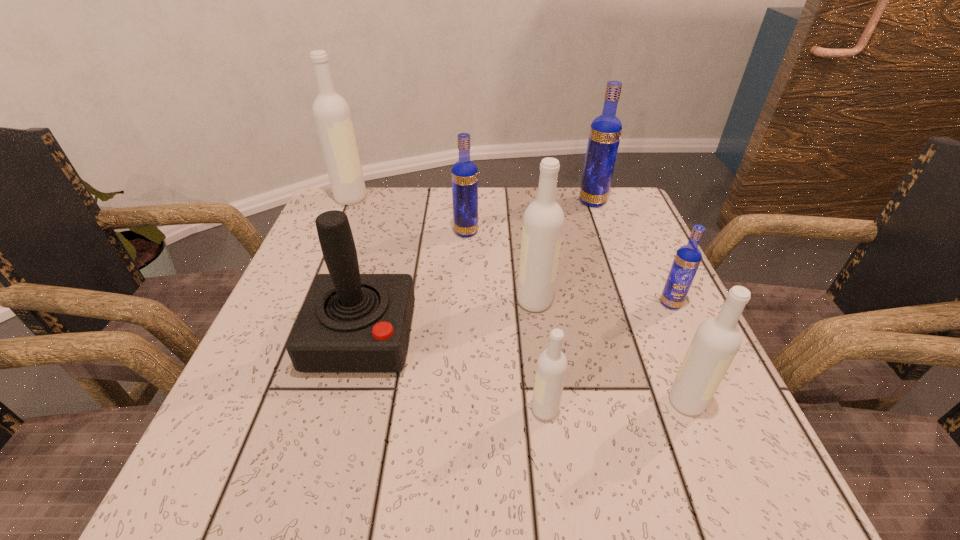
Where is `the tallest object`? The image size is (960, 540). the tallest object is located at coordinates (331, 113).

The image size is (960, 540). In order to click on the tallest vodka in this screenshot , I will do `click(331, 113)`.

Locate an element on the screen. Image resolution: width=960 pixels, height=540 pixels. the biggest blue vodka is located at coordinates (605, 132).

The width and height of the screenshot is (960, 540). What are the coordinates of `the second blue vodka from right to left` in the screenshot? It's located at (605, 132).

The image size is (960, 540). What are the coordinates of `the second farthest white vodka` in the screenshot? It's located at (543, 222).

This screenshot has height=540, width=960. I want to click on red joystick, so click(350, 322).

What are the coordinates of `the third farthest object` in the screenshot? It's located at (464, 174).

Where is `the second vodka from left to right`? This screenshot has width=960, height=540. the second vodka from left to right is located at coordinates (464, 174).

The height and width of the screenshot is (540, 960). What are the coordinates of `the rightmost white vodka` in the screenshot? It's located at (717, 340).

Where is `the nearest blue vodka`? The width and height of the screenshot is (960, 540). the nearest blue vodka is located at coordinates (688, 257).